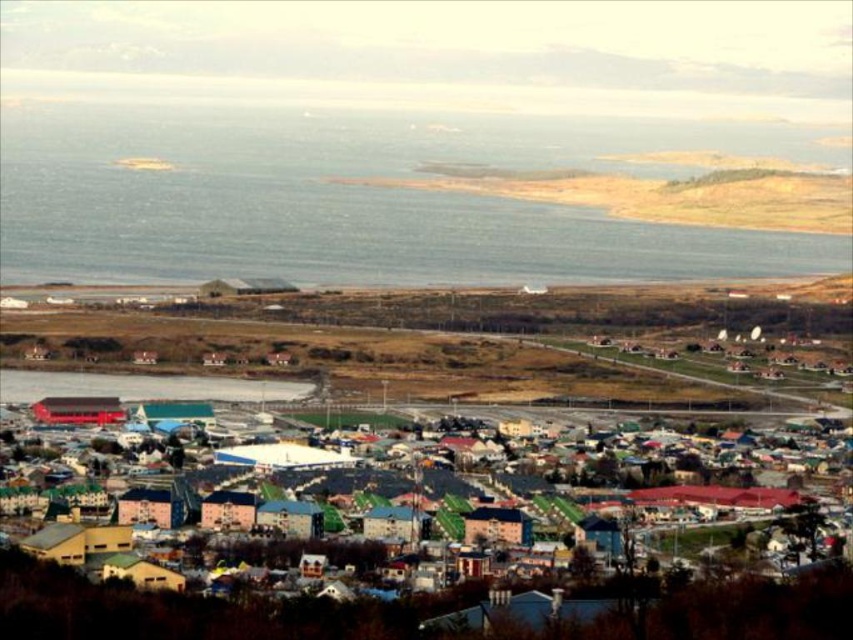
Question: Is blue water at center to the left of multicolored wooden houses at center from the viewer's perspective?

Choices:
 (A) yes
 (B) no

Answer: (A)

Question: Which point appears farthest from the camera in this image?

Choices:
 (A) (257, 445)
 (B) (51, 134)

Answer: (B)

Question: Is blue water at center to the right of multicolored wooden houses at center from the viewer's perspective?

Choices:
 (A) no
 (B) yes

Answer: (A)

Question: Is blue water at center closer to camera compared to multicolored wooden houses at center?

Choices:
 (A) yes
 (B) no

Answer: (B)

Question: Which point is farther from the camera taking this photo?

Choices:
 (A) (659, 477)
 (B) (215, 147)

Answer: (A)